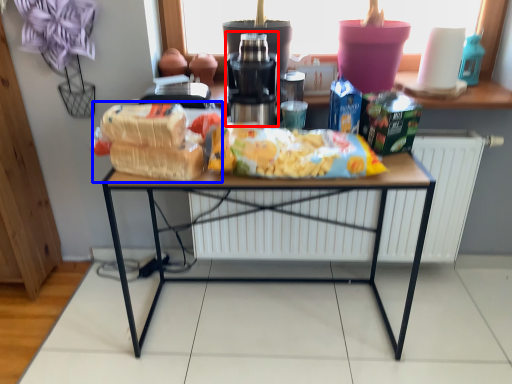
Question: Among these objects, which one is farthest to the camera, coffee machine (highlighted by a red box) or snack (highlighted by a blue box)?

Choices:
 (A) coffee machine
 (B) snack

Answer: (A)